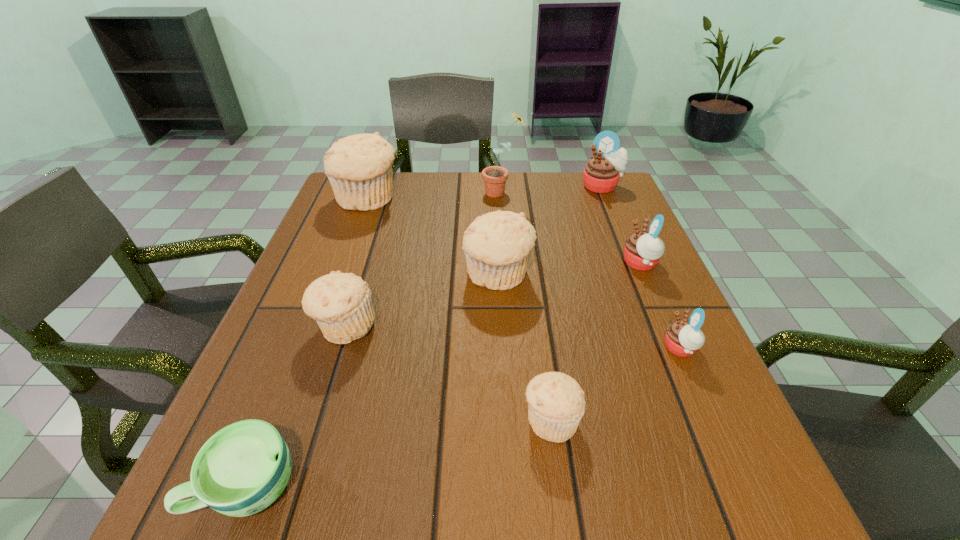
The width and height of the screenshot is (960, 540). In order to click on muffin object that ranks as the closest to the second farthest pink muffin in this screenshot , I will do `click(683, 338)`.

Image resolution: width=960 pixels, height=540 pixels. In order to click on beige muffin identified as the second closest to the third farthest beige muffin in this screenshot , I will do `click(556, 403)`.

Point out which beige muffin is positioned as the nearest to the blue cup. Please provide its 2D coordinates. Your answer should be formatted as a tuple, i.e. [(x, y)], where the tuple contains the x and y coordinates of a point satisfying the conditions above.

[(341, 304)]

Locate which pink muffin is the second closest to the third farthest beige muffin. Please provide its 2D coordinates. Your answer should be formatted as a tuple, i.e. [(x, y)], where the tuple contains the x and y coordinates of a point satisfying the conditions above.

[(683, 338)]

At what (x,y) coordinates should I click in order to perform the action: click on pink muffin that is the second closest to the second smallest pink muffin. Please return your answer as a coordinate pair (x, y). This screenshot has width=960, height=540. Looking at the image, I should click on (602, 172).

Where is `free space that satisfies the following two spatial constraints: 1. on the front-facing side of the second smallest pink muffin; 2. on the front side of the smallest beige muffin`? free space that satisfies the following two spatial constraints: 1. on the front-facing side of the second smallest pink muffin; 2. on the front side of the smallest beige muffin is located at coordinates (708, 420).